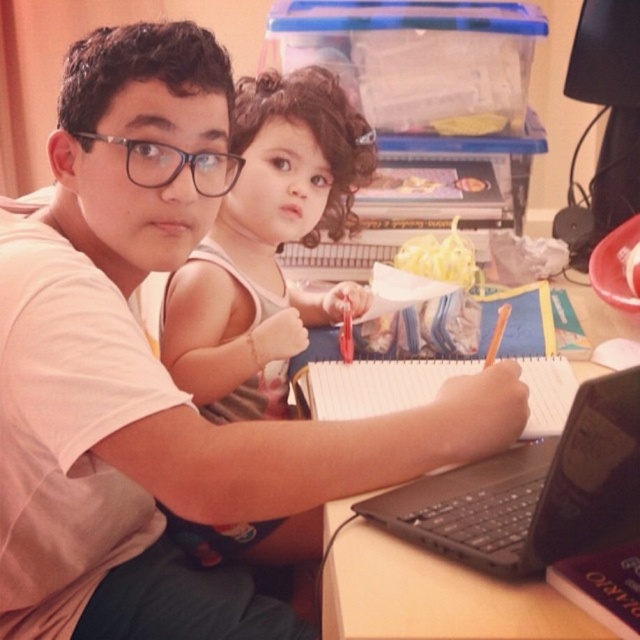
You are organizing a small event and need to know if the smooth beige tank top at upper center can be placed on top of the black plastic laptop at center without covering it entirely. Based on the description, can you determine if the tank top is wider than the laptop?

The smooth beige tank top at upper center is wider than the black plastic laptop at center, so placing it on top would cover the laptop entirely.

Looking at this image, what is the 2D coordinate of the smooth beige tank top at upper center?

The smooth beige tank top at upper center is located at the 2D coordinate point of [266,244].

You are trying to place a small decorative item on the wooden table at center. However, there is a smooth beige tank top at upper center lying on the table. Can you put the item there without moving the tank top?

The smooth beige tank top at upper center is above the wooden table at center, meaning it is covering part of the table. Therefore, you cannot place the item there without moving the tank top.